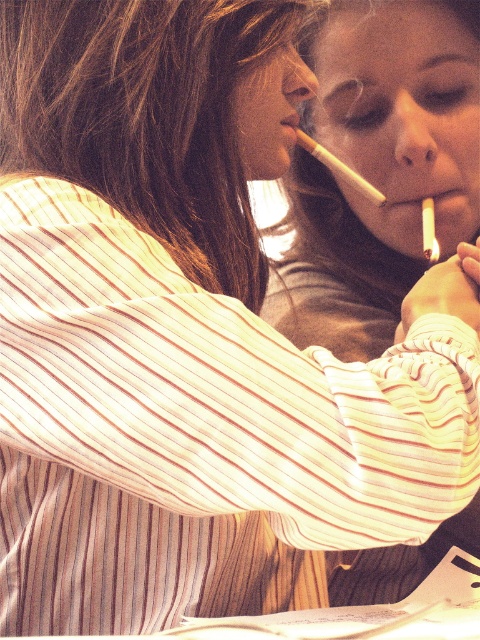
Question: Which point is closer to the camera taking this photo?

Choices:
 (A) (384, 202)
 (B) (421, 211)
 (C) (301, 132)

Answer: (C)

Question: Which point is closer to the camera?

Choices:
 (A) (428, 225)
 (B) (387, 202)

Answer: (A)

Question: Is matte gray shirt at center bigger than white matte cigarette at upper right?

Choices:
 (A) yes
 (B) no

Answer: (A)

Question: Is matte gray shirt at center to the right of white matte cigarette at center from the viewer's perspective?

Choices:
 (A) no
 (B) yes

Answer: (B)

Question: Considering the real-world distances, which object is farthest from the matte gray shirt at center?

Choices:
 (A) white matte cigarette at center
 (B) matte yellow cigarette at center

Answer: (A)

Question: Is matte gray shirt at center wider than matte yellow cigarette at center?

Choices:
 (A) yes
 (B) no

Answer: (A)